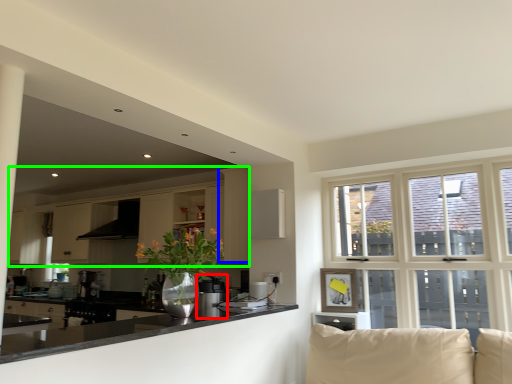
Question: Which object is positioned closest to appliance (highlighted by a red box)? Select from cabinetry (highlighted by a blue box) and cabinetry (highlighted by a green box).

Choices:
 (A) cabinetry
 (B) cabinetry

Answer: (A)